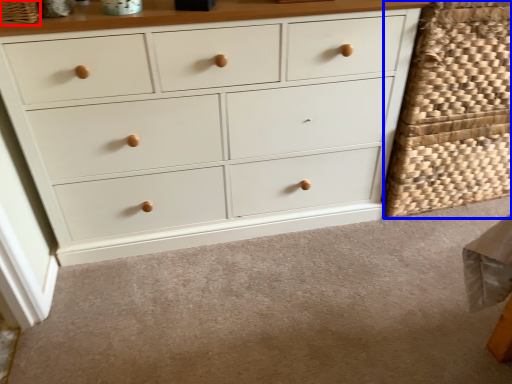
Question: Which point is further to the camera, basket (highlighted by a red box) or basket (highlighted by a blue box)?

Choices:
 (A) basket
 (B) basket

Answer: (B)